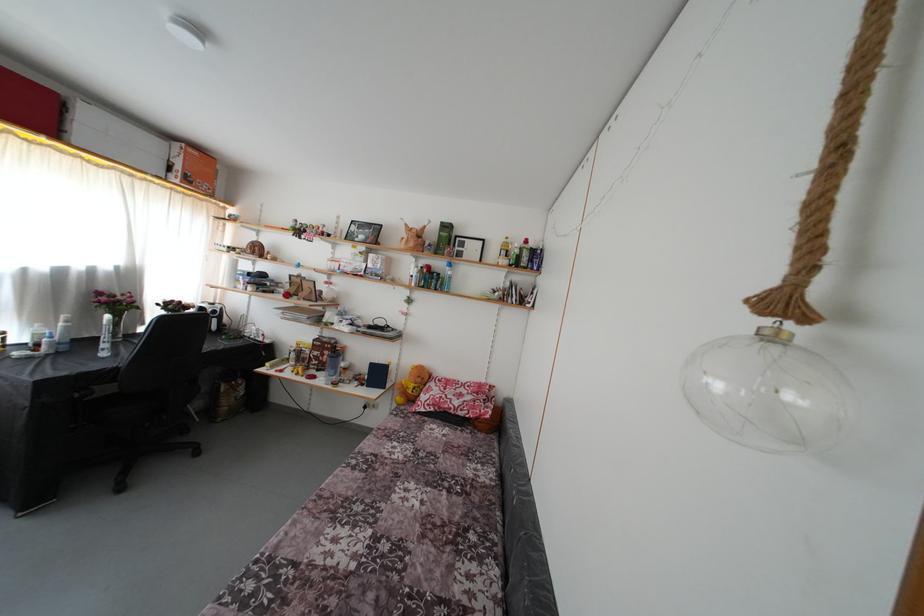
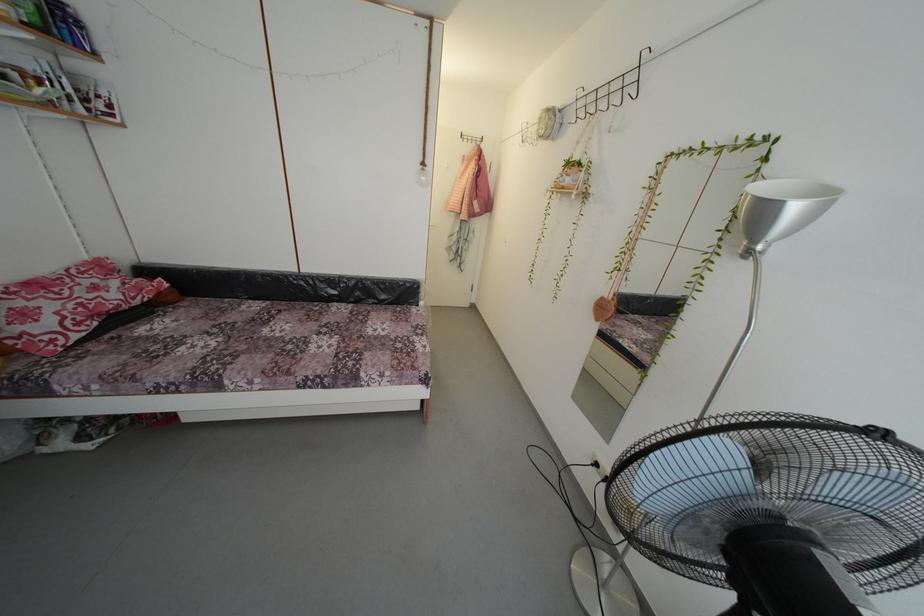
Where in the second image is the point corresponding to [407,464] from the first image?

(225, 345)